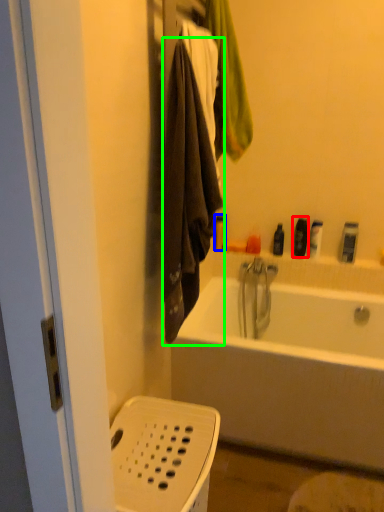
Question: Based on their relative distances, which object is nearer to toiletry (highlighted by a red box)? Choose from toiletry (highlighted by a blue box) and towel/napkin (highlighted by a green box).

Choices:
 (A) toiletry
 (B) towel/napkin

Answer: (A)